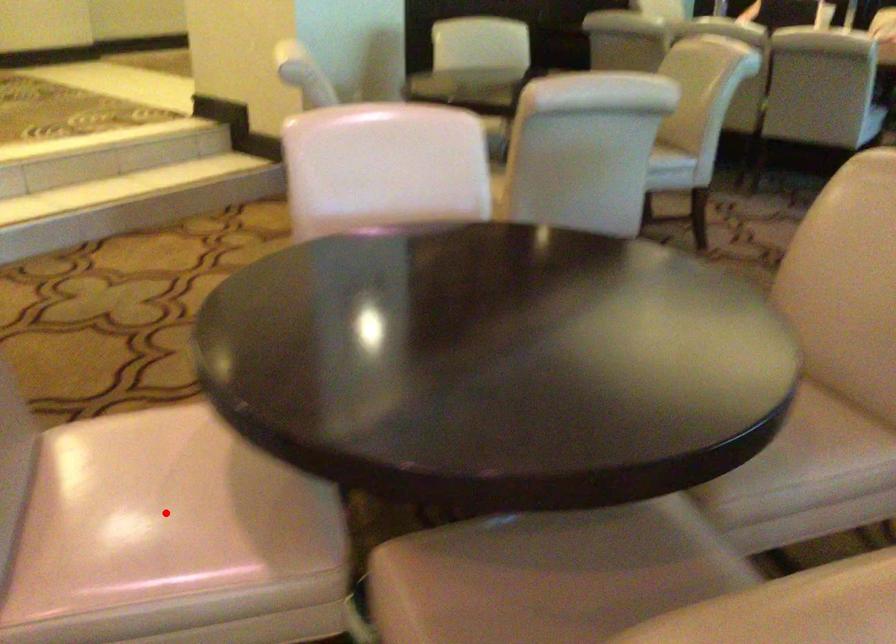
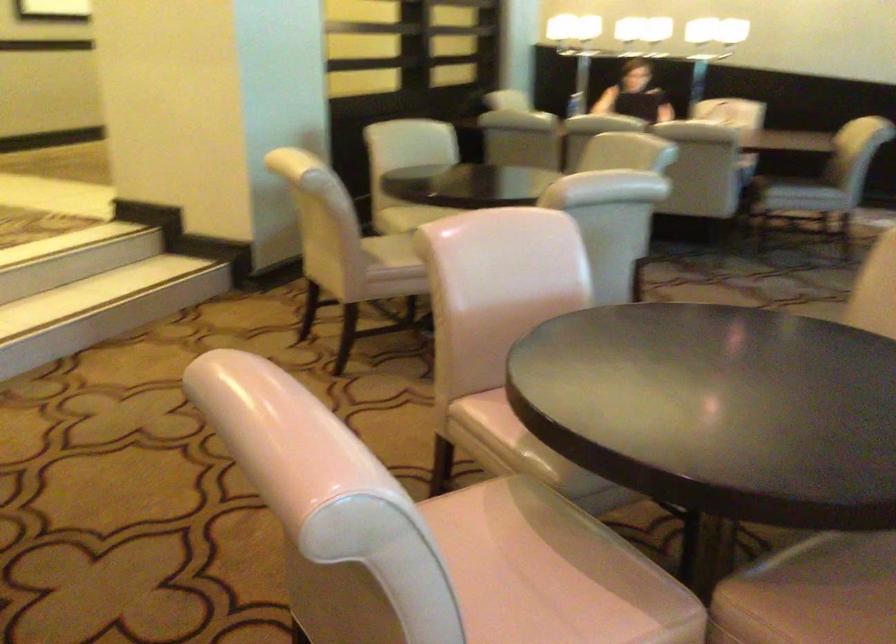
Locate, in the second image, the point that corresponds to the highlighted location in the first image.

(520, 587)